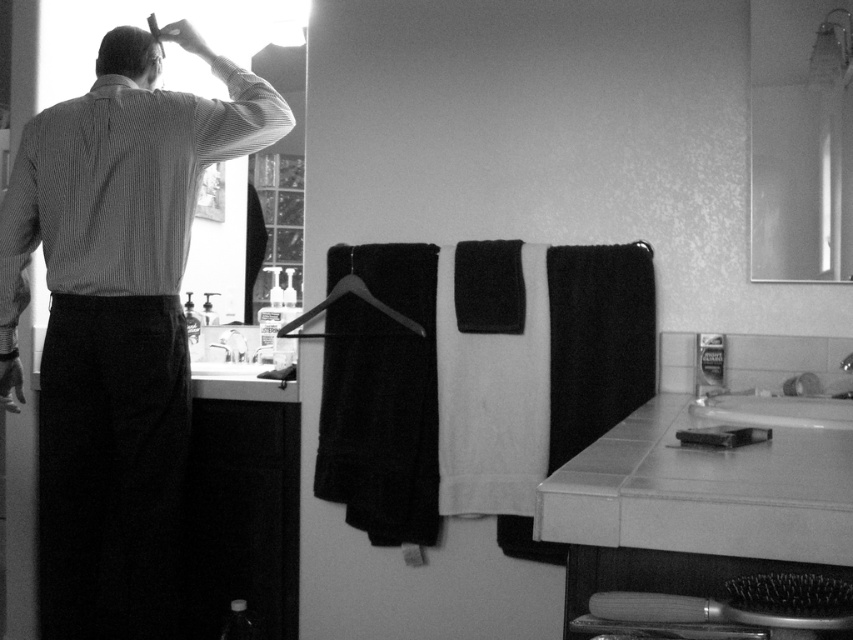
You are a home inspector evaluating the bathroom layout. You need to determine if the white glossy sink at lower center can accommodate a new faucet that requires 10 inches of space. Can the sink provide enough space based on its size compared to the metallic silver towel bar at lower right?

The white glossy sink at lower center has a larger size compared to the metallic silver towel bar at lower right. Since the sink is larger, it likely has sufficient space to accommodate the new faucet requiring 10 inches of space.

Consider the image. You are trying to place a decorative vase between the white glossy sink at lower center and the metallic silver towel bar at lower right. Considering their heights, which object should the vase be placed closer to if you want it to be more stable?

The white glossy sink at lower center has a greater height compared to the metallic silver towel bar at lower right. To ensure stability, the vase should be placed closer to the white glossy sink at lower center since its higher surface would provide a more stable base.